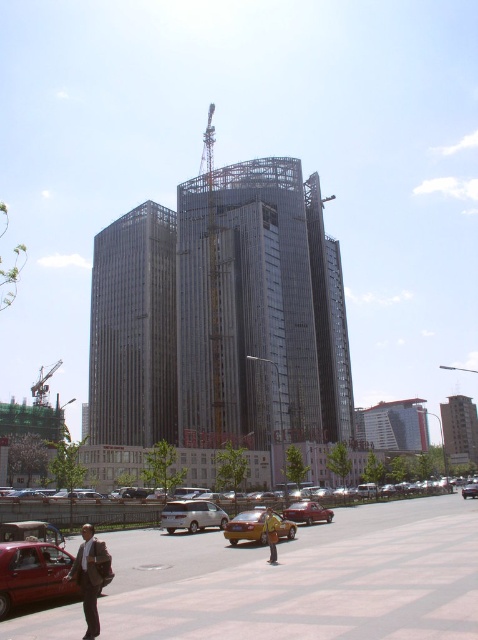
Does point (476, 417) come farther from viewer compared to point (209, 502)?

That is True.

Can you confirm if glassy concrete building at center is bigger than silver metallic van at center?

Correct, glassy concrete building at center is larger in size than silver metallic van at center.

Which is in front, point (452, 401) or point (187, 518)?

Point (187, 518) is in front.

Where is `glassy concrete building at center`? glassy concrete building at center is located at coordinates (459, 429).

Is the position of metallic taxi at lower left more distant than that of metallic yellow taxi at center?

No, it is not.

Does metallic taxi at lower left appear under metallic yellow taxi at center?

Actually, metallic taxi at lower left is above metallic yellow taxi at center.

Between point (58, 589) and point (326, 509), which one is positioned behind?

The point (326, 509) is more distant.

Identify the location of metallic taxi at lower left. This screenshot has width=478, height=640. (32, 573).

Between sleek metallic building at center and glassy concrete building at center, which one appears on the right side from the viewer's perspective?

Positioned to the right is glassy concrete building at center.

Who is taller, sleek metallic building at center or glassy concrete building at center?

sleek metallic building at center

Find the location of a particular element. This screenshot has width=478, height=640. sleek metallic building at center is located at coordinates (133, 330).